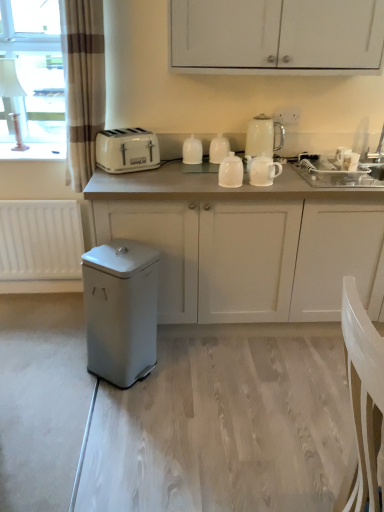
In order to click on vacant space situated on the left part of white matte trash can at lower left in this screenshot , I will do `click(66, 368)`.